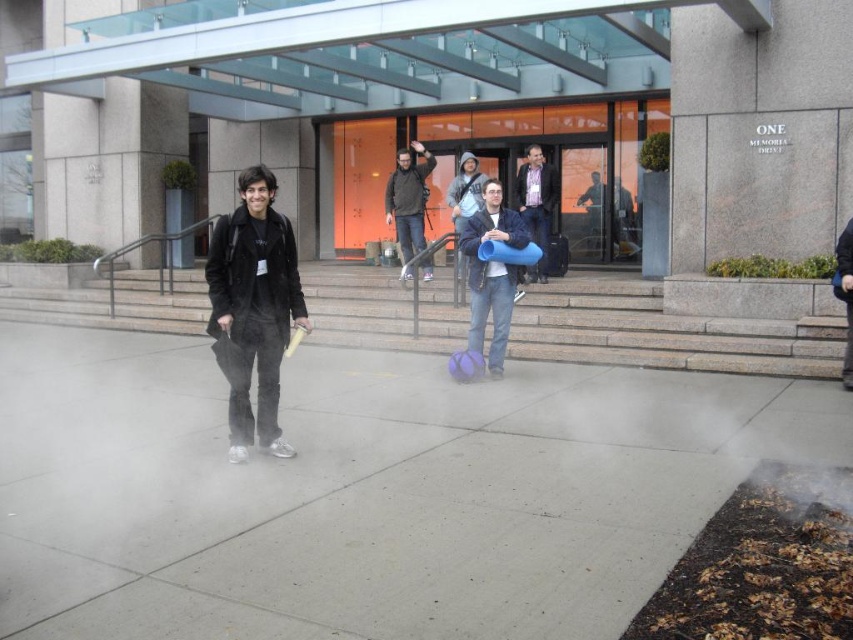
You are standing at the entrance of the building and see the point marked at coordinates point (668, 332). Based on the scene description, where is this point located?

The point (668, 332) is located on the gray concrete stairs at center.

You are standing at the entrance of the building and want to go to the gray concrete stairs at center. In which direction should you walk from the entrance?

The gray concrete stairs at center is located at point (668, 332), so you should walk towards the center of the image from the entrance to reach them.